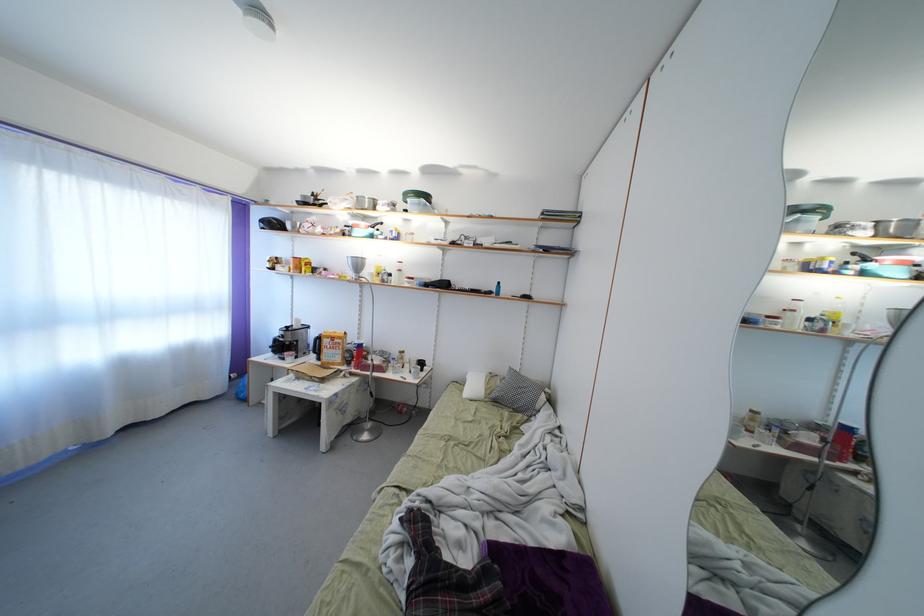
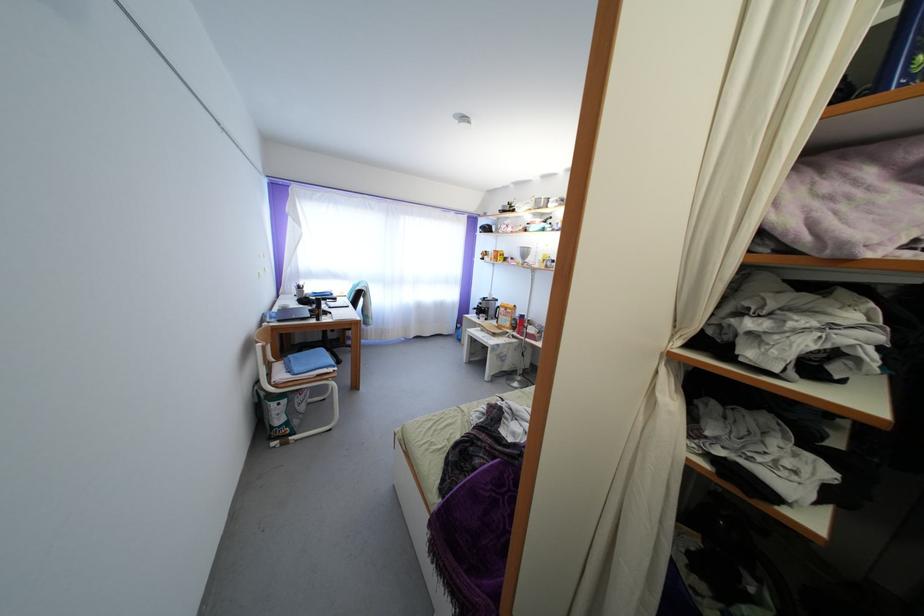
Question: Based on the continuous images, in which direction is the camera rotating? Reply with the corresponding letter.

Choices:
 (A) Left
 (B) Right
 (C) Up
 (D) Down

Answer: (A)